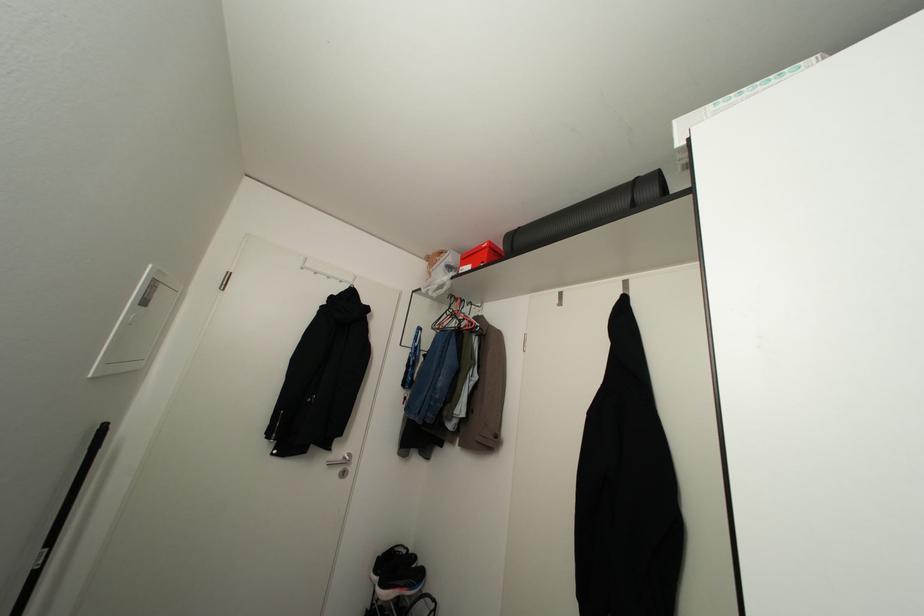
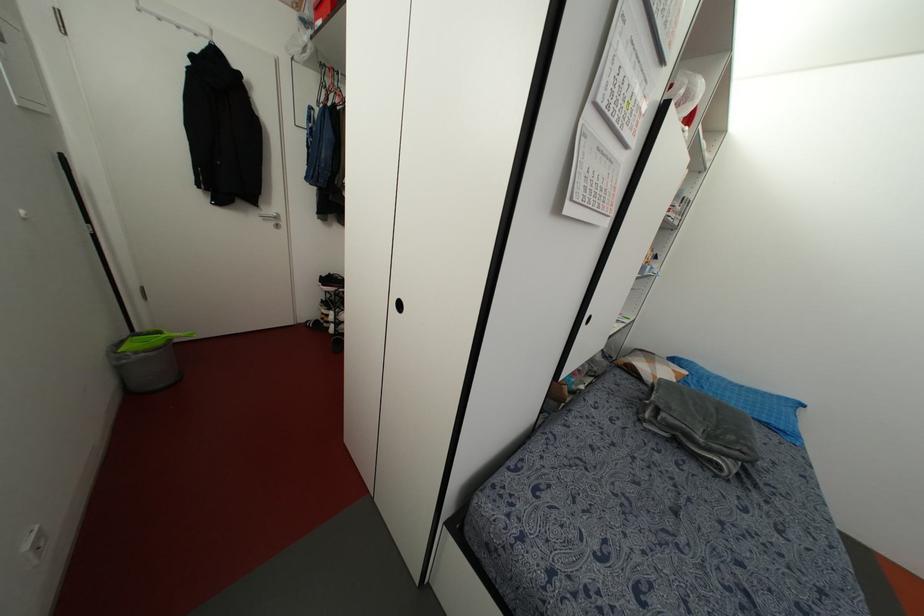
In the second image, find the point that corresponds to point (343, 472) in the first image.

(276, 225)